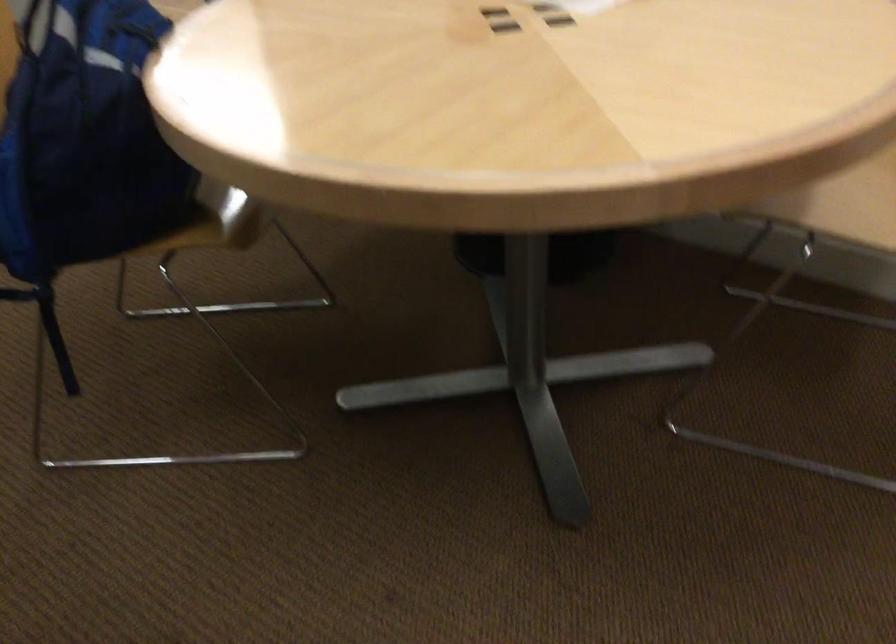
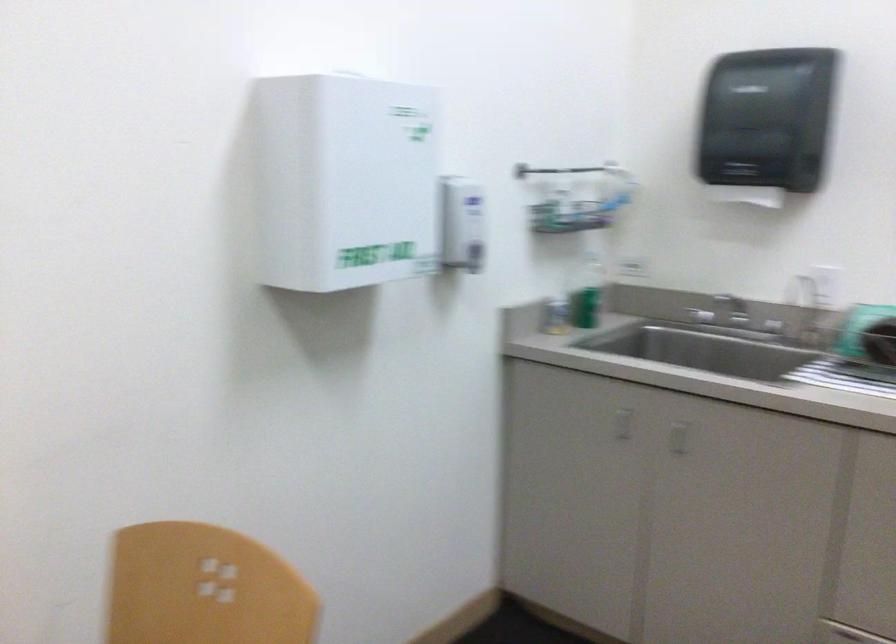
Question: How did the camera likely rotate?

Choices:
 (A) Left
 (B) Right
 (C) Up
 (D) Down

Answer: (B)